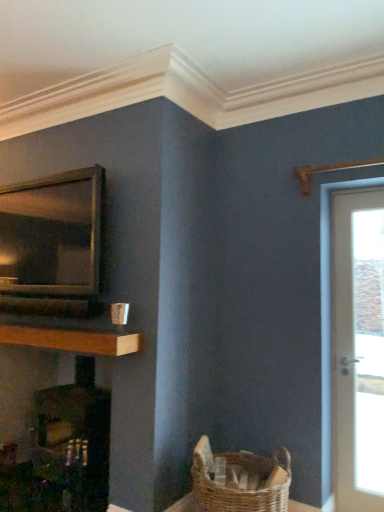
Question: Considering the relative sizes of wooden at left and matte black fireplace at left in the image provided, is wooden at left bigger than matte black fireplace at left?

Choices:
 (A) yes
 (B) no

Answer: (B)

Question: Does wooden at left have a lesser height compared to matte black fireplace at left?

Choices:
 (A) yes
 (B) no

Answer: (A)

Question: Is wooden at left facing towards matte black fireplace at left?

Choices:
 (A) yes
 (B) no

Answer: (B)

Question: Is wooden at left looking in the opposite direction of matte black fireplace at left?

Choices:
 (A) no
 (B) yes

Answer: (A)

Question: Is wooden at left with matte black fireplace at left?

Choices:
 (A) no
 (B) yes

Answer: (A)

Question: Is white glossy door at right spatially inside matte black fireplace at left, or outside of it?

Choices:
 (A) inside
 (B) outside

Answer: (B)

Question: From a real-world perspective, is white glossy door at right physically located above or below matte black fireplace at left?

Choices:
 (A) above
 (B) below

Answer: (A)

Question: From their relative heights in the image, would you say white glossy door at right is taller or shorter than matte black fireplace at left?

Choices:
 (A) tall
 (B) short

Answer: (A)

Question: Visually, is white glossy door at right positioned to the left or to the right of matte black fireplace at left?

Choices:
 (A) right
 (B) left

Answer: (A)

Question: From a real-world perspective, is matte black fireplace at left physically located above or below white glossy door at right?

Choices:
 (A) below
 (B) above

Answer: (A)

Question: Is matte black fireplace at left wider or thinner than white glossy door at right?

Choices:
 (A) thin
 (B) wide

Answer: (B)

Question: Based on their sizes in the image, would you say matte black fireplace at left is bigger or smaller than white glossy door at right?

Choices:
 (A) small
 (B) big

Answer: (B)

Question: Would you say matte black fireplace at left is inside or outside white glossy door at right?

Choices:
 (A) outside
 (B) inside

Answer: (A)

Question: Considering the positions of matte black fireplace at left and wooden at left in the image, is matte black fireplace at left bigger or smaller than wooden at left?

Choices:
 (A) big
 (B) small

Answer: (A)

Question: Is matte black fireplace at left spatially inside wooden at left, or outside of it?

Choices:
 (A) outside
 (B) inside

Answer: (A)